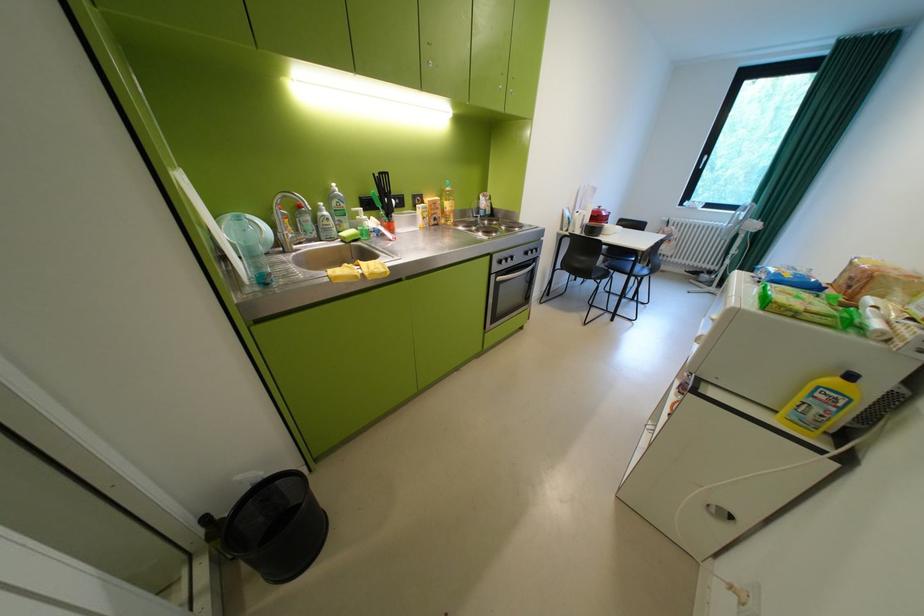
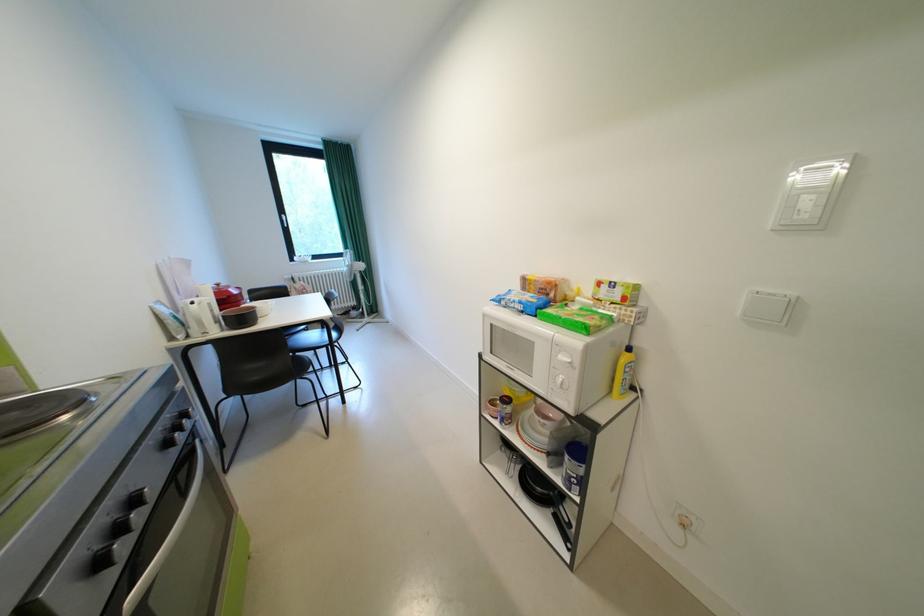
Where in the second image is the point corresponding to [537,254] from the first image?

(176, 446)